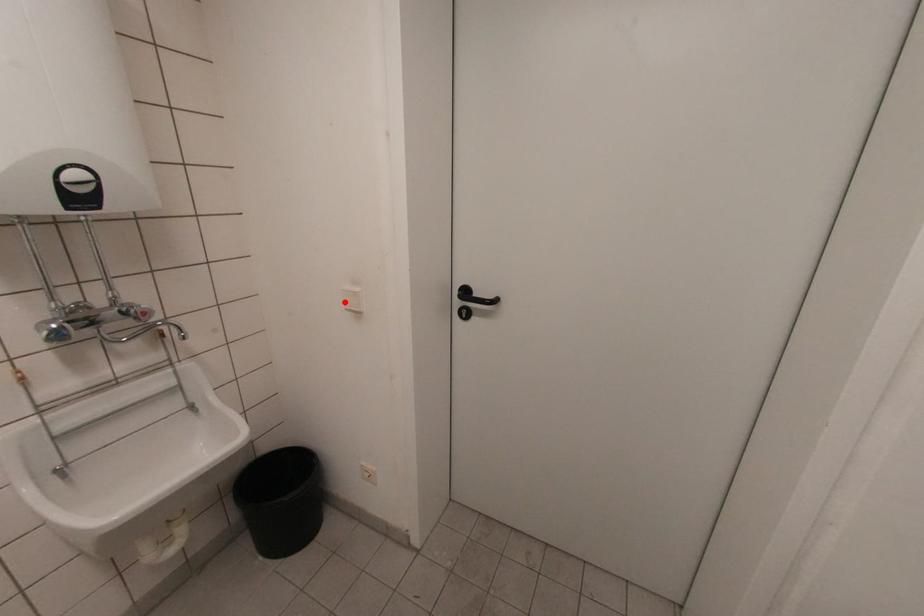
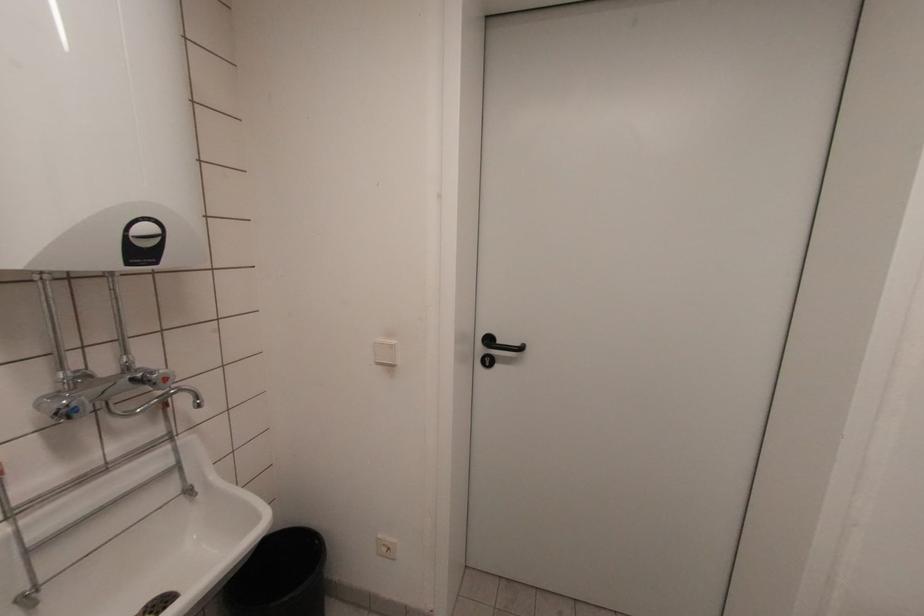
Find the pixel in the second image that matches the highlighted location in the first image.

(375, 355)